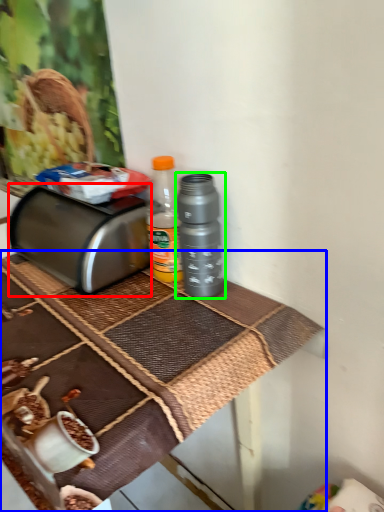
Question: Estimate the real-world distances between objects in this image. Which object is farther from toaster (highlighted by a red box), table (highlighted by a blue box) or bottle (highlighted by a green box)?

Choices:
 (A) table
 (B) bottle

Answer: (B)